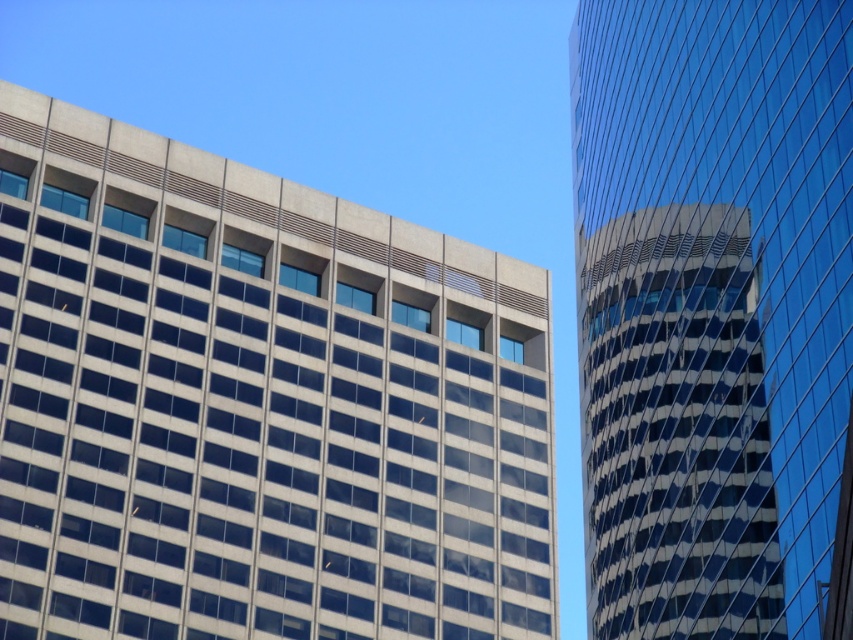
Question: Can you confirm if gray concrete building at upper left is positioned to the left of glassy reflective tower at right?

Choices:
 (A) yes
 (B) no

Answer: (A)

Question: Which point is farther from the camera taking this photo?

Choices:
 (A) (740, 541)
 (B) (4, 266)

Answer: (B)

Question: Can you confirm if gray concrete building at upper left is positioned above glassy reflective tower at right?

Choices:
 (A) no
 (B) yes

Answer: (A)

Question: Can you confirm if gray concrete building at upper left is positioned to the right of glassy reflective tower at right?

Choices:
 (A) yes
 (B) no

Answer: (B)